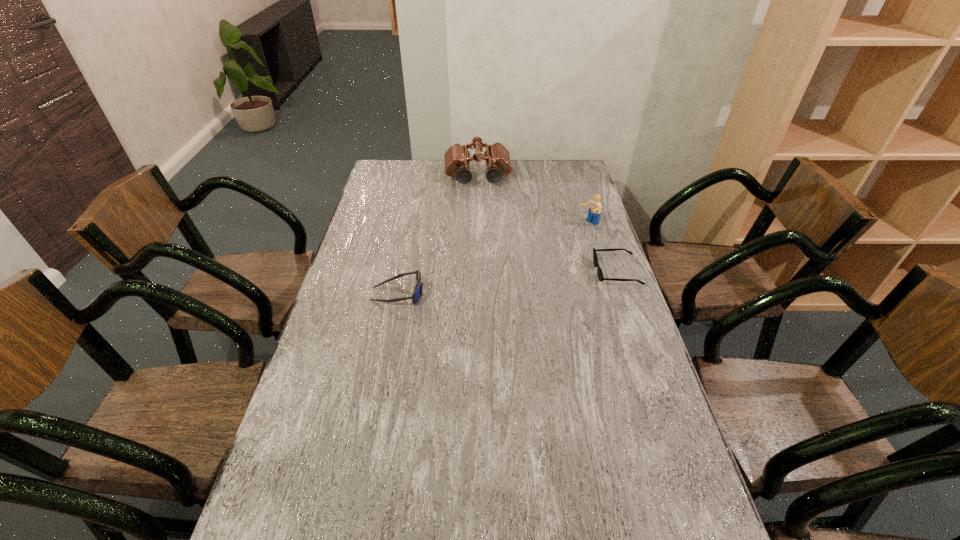
Find the location of a particular element. The height and width of the screenshot is (540, 960). free space that is in between the right sunglasses and the binoculars is located at coordinates (547, 224).

This screenshot has width=960, height=540. What are the coordinates of `empty space between the taller sunglasses and the Lego` in the screenshot? It's located at (493, 259).

Where is `vacant point located between the left sunglasses and the shorter sunglasses`? vacant point located between the left sunglasses and the shorter sunglasses is located at coordinates (507, 282).

Find the location of a particular element. The width and height of the screenshot is (960, 540). vacant point located between the tallest object and the leftmost object is located at coordinates (438, 235).

Where is `empty space that is in between the second farthest object and the tallest object`? The height and width of the screenshot is (540, 960). empty space that is in between the second farthest object and the tallest object is located at coordinates (533, 200).

Identify the location of empty location between the tallest object and the shortest object. This screenshot has height=540, width=960. (547, 224).

Find the location of a particular element. vacant area that lies between the Lego and the farthest object is located at coordinates (533, 200).

Where is `free space between the second shortest object and the tallest object`? free space between the second shortest object and the tallest object is located at coordinates (438, 235).

Where is `object that is the closest one to the second tallest object`? This screenshot has width=960, height=540. object that is the closest one to the second tallest object is located at coordinates (599, 271).

Identify which object is the second nearest to the binoculars. Please provide its 2D coordinates. Your answer should be formatted as a tuple, i.e. [(x, y)], where the tuple contains the x and y coordinates of a point satisfying the conditions above.

[(599, 271)]